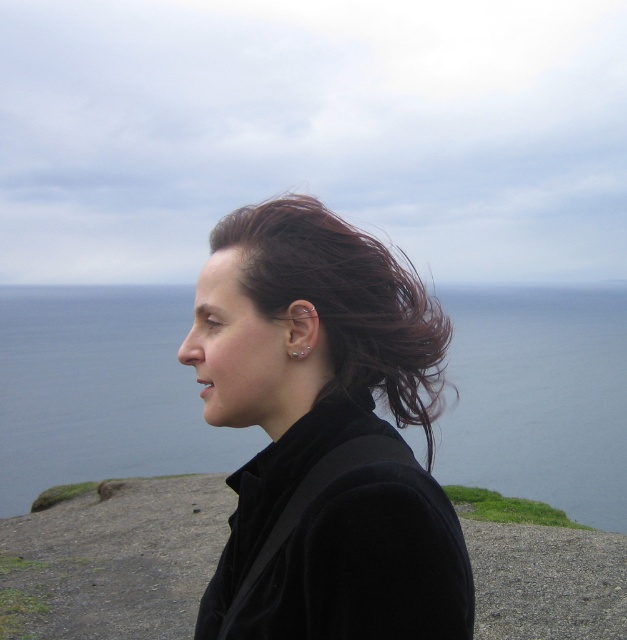
Question: Which point appears closest to the camera in this image?

Choices:
 (A) (382, 557)
 (B) (408, 371)

Answer: (A)

Question: Does matte black hair at center have a smaller size compared to blue water at center?

Choices:
 (A) no
 (B) yes

Answer: (B)

Question: Which of the following is the farthest from the observer?

Choices:
 (A) (435, 301)
 (B) (236, 308)

Answer: (A)

Question: Does matte black hair at center come in front of dark brown hair at center?

Choices:
 (A) yes
 (B) no

Answer: (A)

Question: Which point is farther to the camera?

Choices:
 (A) blue water at center
 (B) matte black hair at center

Answer: (A)

Question: Is matte black hair at center smaller than dark brown hair at center?

Choices:
 (A) no
 (B) yes

Answer: (A)